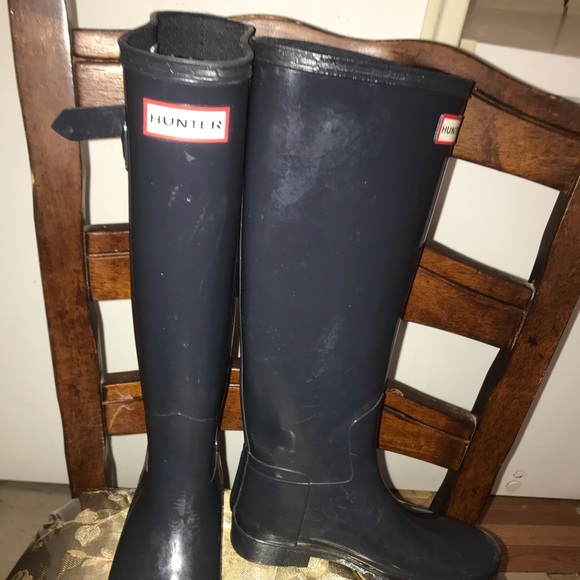
I want to click on horizontal boards for back rest, so click(474, 119), click(447, 297), click(430, 425).